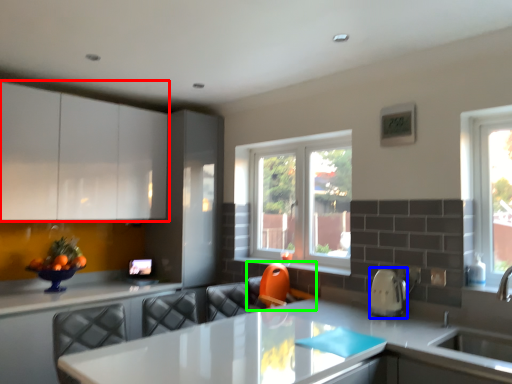
Question: Which object is the closest to the cabinetry (highlighted by a red box)? Choose among these: appliance (highlighted by a blue box) or swivel chair (highlighted by a green box).

Choices:
 (A) appliance
 (B) swivel chair

Answer: (B)